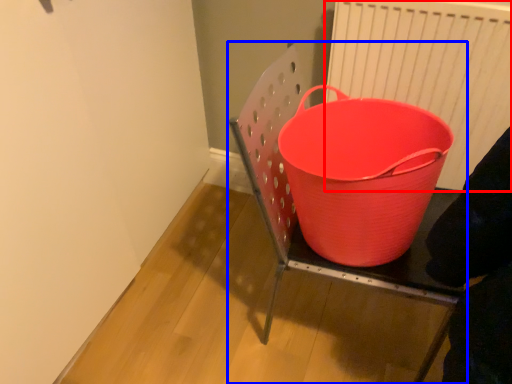
Question: Which of the following is the farthest to the observer, radiator (highlighted by a red box) or furniture (highlighted by a blue box)?

Choices:
 (A) radiator
 (B) furniture

Answer: (A)